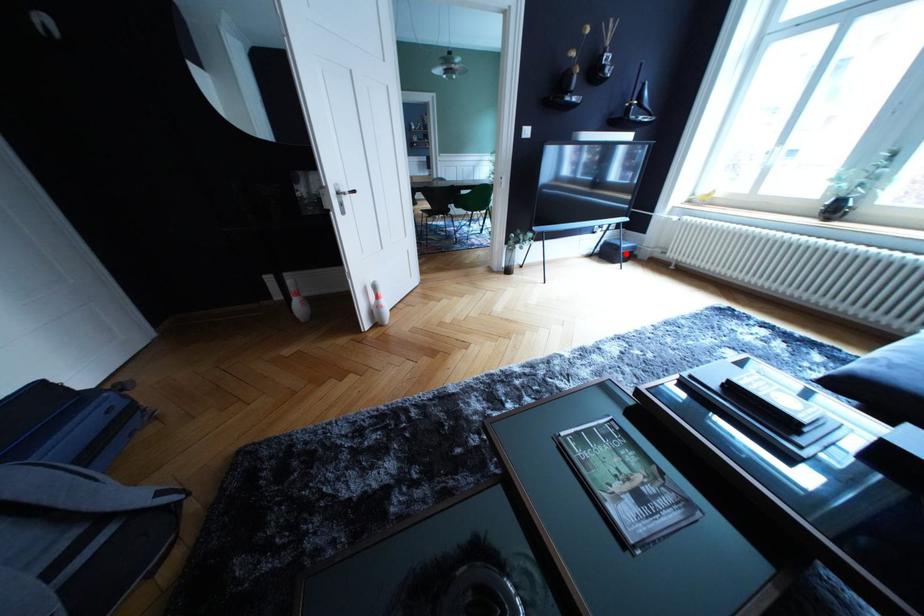
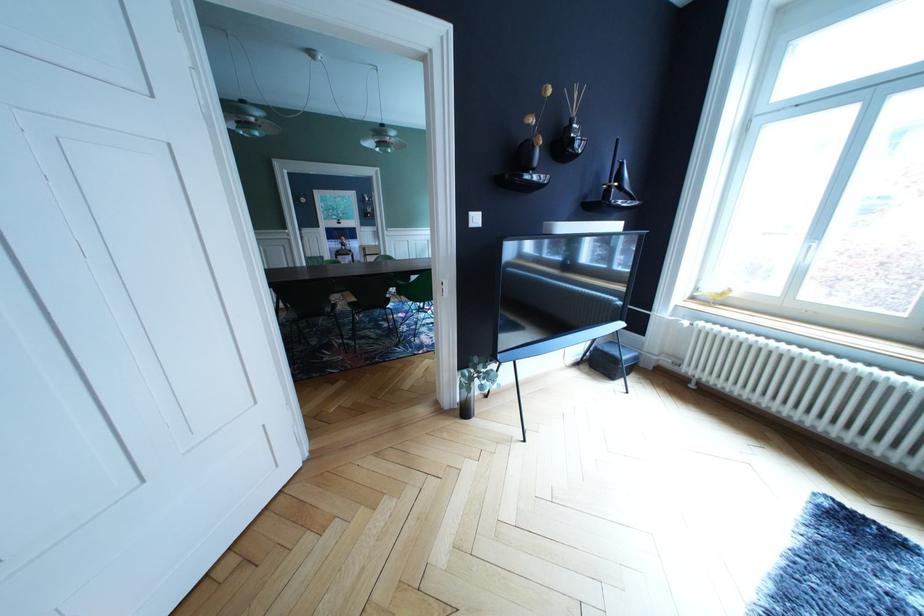
Locate, in the second image, the point that corresponds to the highlighted location in the first image.

(625, 367)